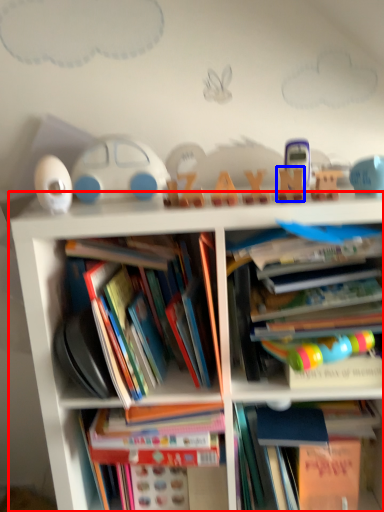
Question: Which object is closer to the camera taking this photo, bookcase (highlighted by a red box) or toy (highlighted by a blue box)?

Choices:
 (A) bookcase
 (B) toy

Answer: (A)